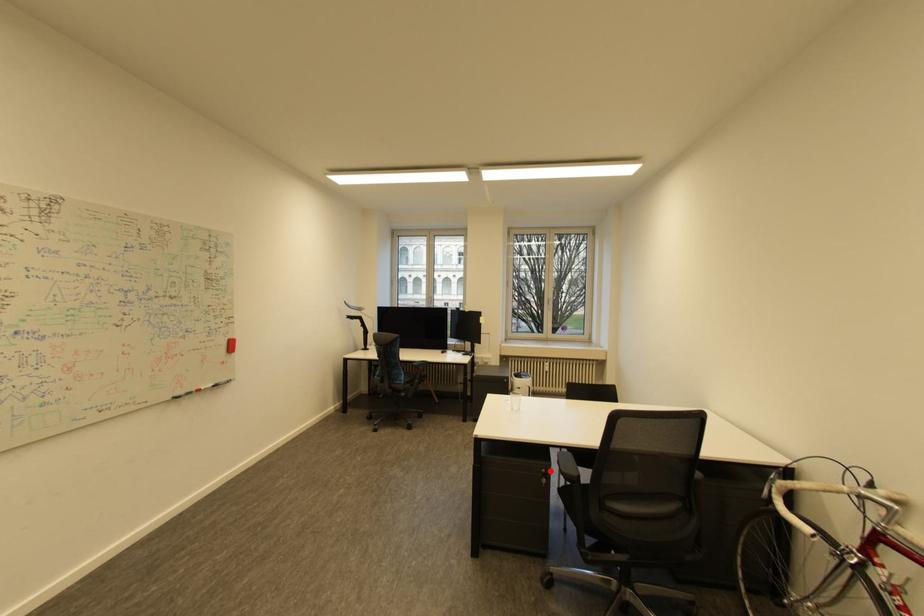
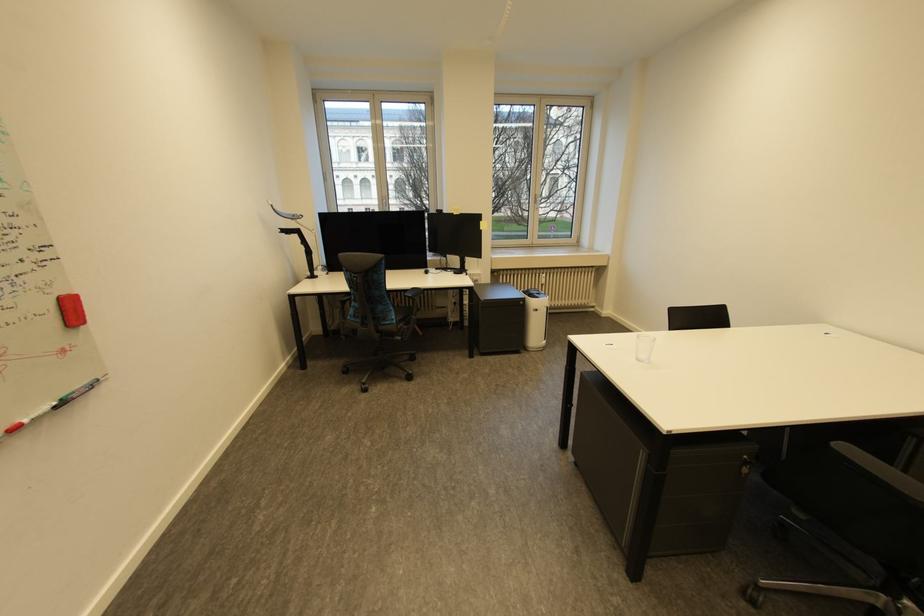
In the second image, find the point that corresponds to the highlighted location in the first image.

(752, 456)